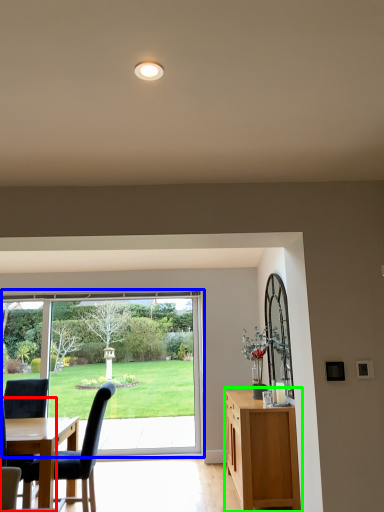
Question: Considering the real-world distances, which object is farthest from chair (highlighted by a red box)? window (highlighted by a blue box) or cabinetry (highlighted by a green box)?

Choices:
 (A) window
 (B) cabinetry

Answer: (A)